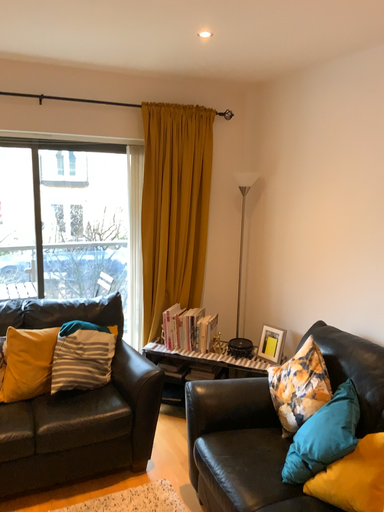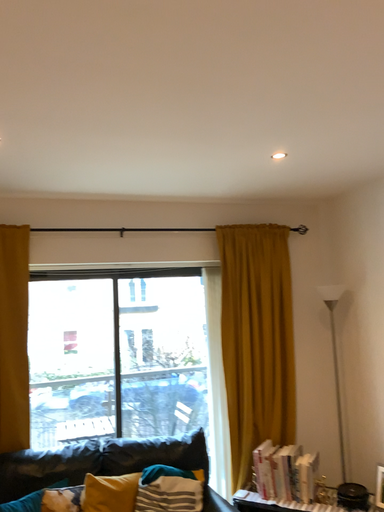
Question: How did the camera likely rotate when shooting the video?

Choices:
 (A) rotated downward
 (B) rotated upward

Answer: (B)